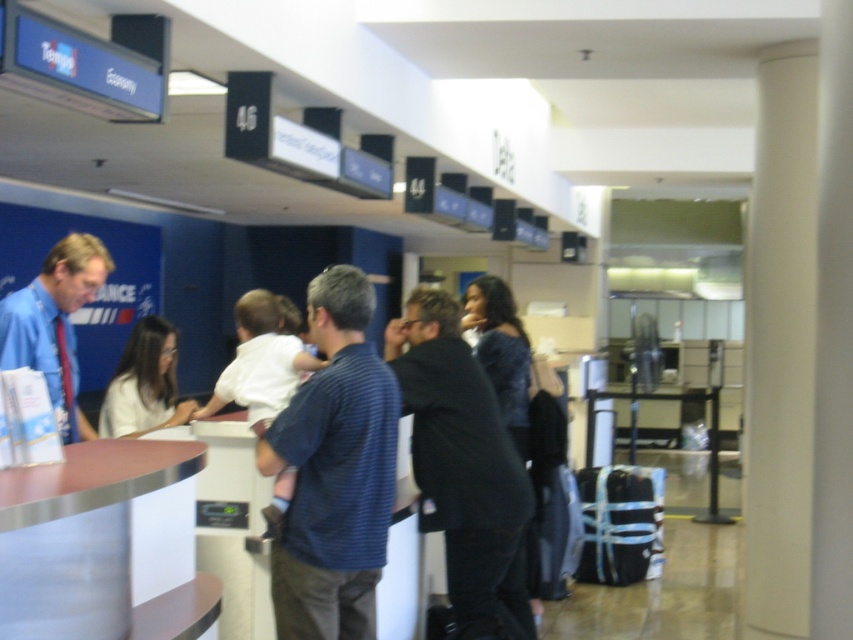
Question: Which object appears farthest from the camera in this image?

Choices:
 (A) blue striped shirt at center
 (B) black matte jacket at center
 (C) white shirt at center
 (D) blue shirt at left

Answer: (C)

Question: Which point appears farthest from the camera in this image?

Choices:
 (A) (279, 412)
 (B) (28, 365)
 (C) (454, 340)

Answer: (C)

Question: Is blue striped shirt at center closer to the viewer compared to white shirt at center?

Choices:
 (A) yes
 (B) no

Answer: (A)

Question: Which of these objects is positioned closest to the white shirt at center?

Choices:
 (A) blue striped shirt at center
 (B) blue shirt at left
 (C) black matte jacket at center

Answer: (B)

Question: Does blue striped shirt at center have a greater width compared to blue shirt at left?

Choices:
 (A) no
 (B) yes

Answer: (B)

Question: Does black matte jacket at center appear over blue shirt at left?

Choices:
 (A) no
 (B) yes

Answer: (A)